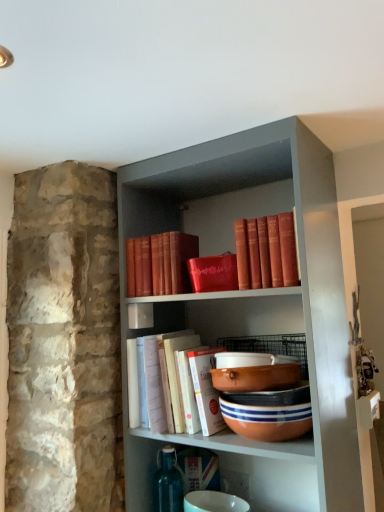
Question: Can you confirm if terracotta clay bowl at center, arranged as the second bowl when ordered from the bottom, is positioned to the right of red leather book at upper center, marked as the 3th book in a bottom-to-top arrangement?

Choices:
 (A) no
 (B) yes

Answer: (A)

Question: Can you confirm if terracotta clay bowl at center, arranged as the second bowl when ordered from the bottom, is taller than red leather book at upper center, arranged as the 1th book when viewed from the top?

Choices:
 (A) no
 (B) yes

Answer: (A)

Question: From a real-world perspective, is terracotta clay bowl at center, arranged as the second bowl when ordered from the bottom, on top of red leather book at upper center, marked as the 3th book in a bottom-to-top arrangement?

Choices:
 (A) no
 (B) yes

Answer: (A)

Question: Does terracotta clay bowl at center, which is the 2th bowl in top-to-bottom order, have a lesser width compared to red leather book at upper center, marked as the 3th book in a bottom-to-top arrangement?

Choices:
 (A) no
 (B) yes

Answer: (B)

Question: From the image's perspective, is terracotta clay bowl at center, which is the 2th bowl in top-to-bottom order, on top of red leather book at upper center, arranged as the 1th book when viewed from the top?

Choices:
 (A) yes
 (B) no

Answer: (B)

Question: Is matte red book at upper center, positioned as the 2th book in bottom-to-top order, inside the boundaries of matte orange bowl at center, which is the first bowl from top to bottom, or outside?

Choices:
 (A) outside
 (B) inside

Answer: (A)

Question: Is matte red book at upper center, the second book from the top, in front of or behind matte orange bowl at center, which is the first bowl from top to bottom, in the image?

Choices:
 (A) behind
 (B) front

Answer: (A)

Question: Does point (155, 237) appear closer or farther from the camera than point (288, 373)?

Choices:
 (A) farther
 (B) closer

Answer: (A)

Question: Considering the positions of matte red book at upper center, positioned as the 2th book in bottom-to-top order, and matte orange bowl at center, which is counted as the 3th bowl, starting from the bottom, in the image, is matte red book at upper center, positioned as the 2th book in bottom-to-top order, wider or thinner than matte orange bowl at center, which is counted as the 3th bowl, starting from the bottom,?

Choices:
 (A) wide
 (B) thin

Answer: (A)

Question: Visually, is red leather book at upper center, arranged as the 1th book when viewed from the top, positioned to the left or to the right of matte orange bowl at center, which is the first bowl from top to bottom?

Choices:
 (A) left
 (B) right

Answer: (B)

Question: Is red leather book at upper center, arranged as the 1th book when viewed from the top, wider or thinner than matte orange bowl at center, which is the first bowl from top to bottom?

Choices:
 (A) thin
 (B) wide

Answer: (B)

Question: Is red leather book at upper center, marked as the 3th book in a bottom-to-top arrangement, inside or outside of matte orange bowl at center, which is the first bowl from top to bottom?

Choices:
 (A) outside
 (B) inside

Answer: (A)

Question: Does point (281, 243) appear closer or farther from the camera than point (263, 366)?

Choices:
 (A) farther
 (B) closer

Answer: (B)

Question: From a real-world perspective, is terracotta clay bowl at center, positioned as the 3th bowl in top-to-bottom order, physically located above or below terracotta clay bowl at center, which is the 2th bowl in top-to-bottom order?

Choices:
 (A) below
 (B) above

Answer: (A)

Question: Is terracotta clay bowl at center, positioned as the 3th bowl in top-to-bottom order, to the left or to the right of terracotta clay bowl at center, which is the 2th bowl in top-to-bottom order, in the image?

Choices:
 (A) right
 (B) left

Answer: (A)